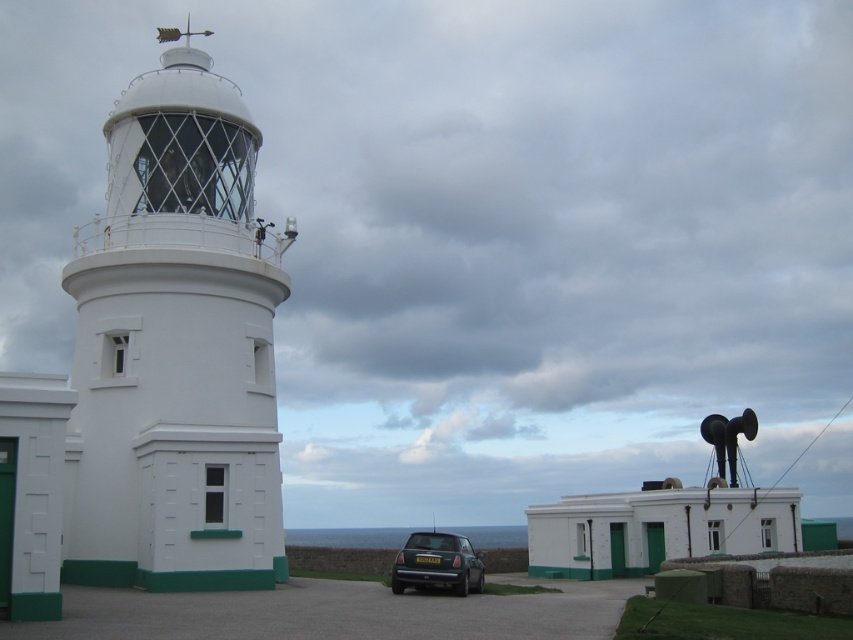
Question: Can you confirm if white glass lighthouse at left is positioned to the left of metallic gray hatchback at lower center?

Choices:
 (A) no
 (B) yes

Answer: (B)

Question: Is white glass lighthouse at left positioned in front of metallic gray hatchback at lower center?

Choices:
 (A) yes
 (B) no

Answer: (A)

Question: Does white glass lighthouse at left have a greater width compared to metallic gray hatchback at lower center?

Choices:
 (A) no
 (B) yes

Answer: (B)

Question: Which object is closer to the camera taking this photo?

Choices:
 (A) metallic gray hatchback at lower center
 (B) white glass lighthouse at left

Answer: (B)